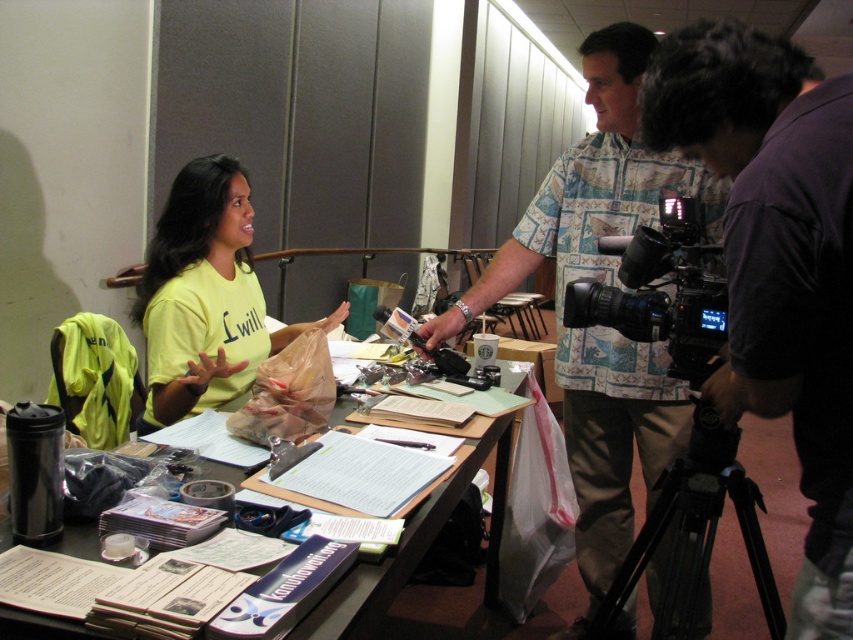
Which is behind, point (193, 385) or point (578, 324)?

The point (193, 385) is behind.

Can you confirm if yellow matte shirt at center is positioned below black matte video camera at center?

Indeed, yellow matte shirt at center is positioned under black matte video camera at center.

This screenshot has height=640, width=853. What are the coordinates of `yellow matte shirt at center` in the screenshot? It's located at (206, 296).

Between purple cotton shirt at right and floral shirt at center, which one has less height?

Standing shorter between the two is purple cotton shirt at right.

Identify the location of purple cotton shirt at right. The height and width of the screenshot is (640, 853). (776, 262).

Does floral shirt at center have a lesser height compared to black matte video camera at center?

No.

Does floral shirt at center appear on the right side of black matte video camera at center?

Correct, you'll find floral shirt at center to the right of black matte video camera at center.

Is point (606, 188) in front of point (633, 241)?

No, it is behind (633, 241).

You are a GUI agent. You are given a task and a screenshot of the screen. Output one action in this format:
    pyautogui.click(x=<x>, y=<y>)
    Task: Click on the floral shirt at center
    Image resolution: width=853 pixels, height=640 pixels.
    Given the screenshot: What is the action you would take?
    pyautogui.click(x=590, y=188)